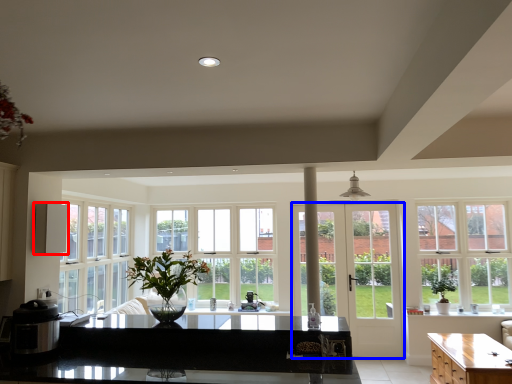
Question: Which object appears farthest to the camera in this image, appliance (highlighted by a red box) or door (highlighted by a blue box)?

Choices:
 (A) appliance
 (B) door

Answer: (B)